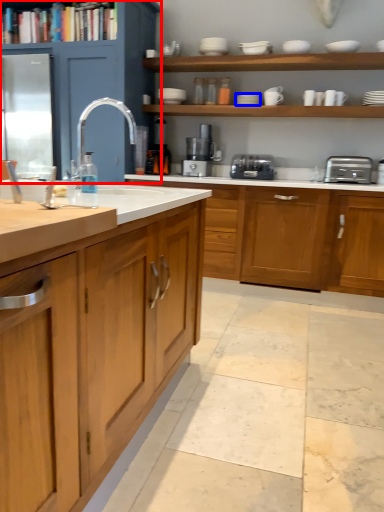
Question: Which object is closer to the camera taking this photo, cabinetry (highlighted by a red box) or tableware (highlighted by a blue box)?

Choices:
 (A) cabinetry
 (B) tableware

Answer: (A)